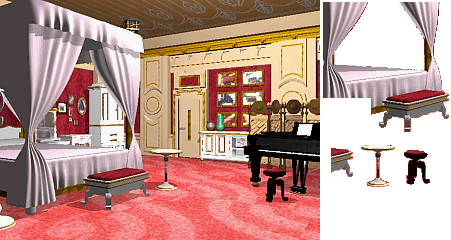
Find the location of a particular element. vase is located at coordinates (221, 128).